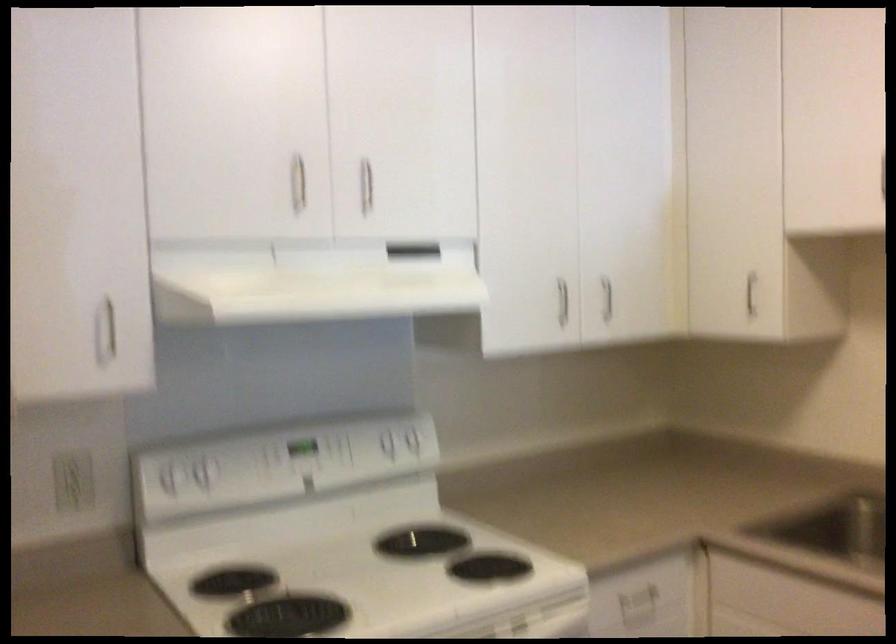
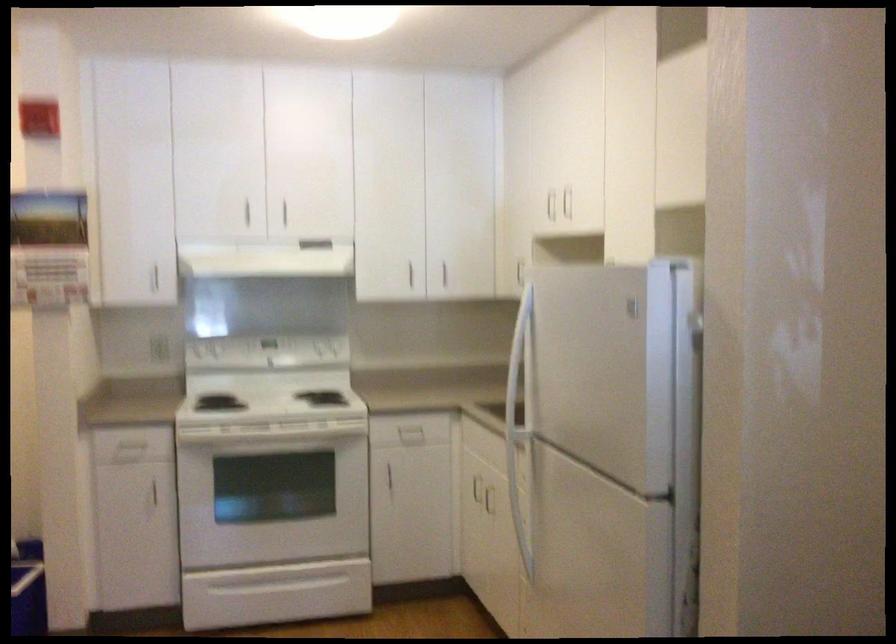
Which direction would the cameraman need to move to produce the second image?

The cameraman moved toward right, backward.